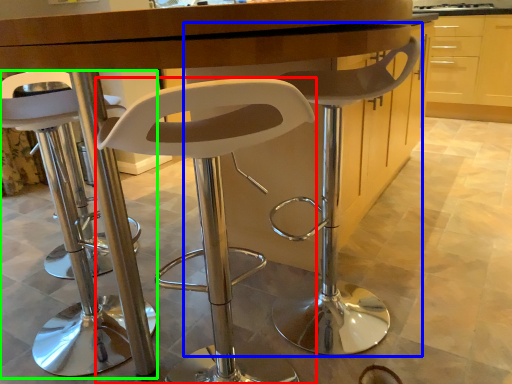
Question: Considering the real-world distances, which object is closest to chair (highlighted by a red box)? chair (highlighted by a blue box) or chair (highlighted by a green box).

Choices:
 (A) chair
 (B) chair

Answer: (A)